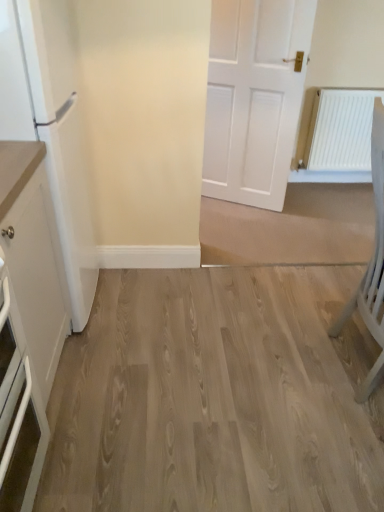
Question: Is white glossy refrigerator at left facing towards light wood flooring at center?

Choices:
 (A) yes
 (B) no

Answer: (A)

Question: From the image's perspective, is white glossy refrigerator at left below light wood flooring at center?

Choices:
 (A) no
 (B) yes

Answer: (A)

Question: Is white glossy refrigerator at left facing away from light wood flooring at center?

Choices:
 (A) no
 (B) yes

Answer: (A)

Question: Is white glossy refrigerator at left directly adjacent to light wood flooring at center?

Choices:
 (A) no
 (B) yes

Answer: (A)

Question: Is white glossy refrigerator at left shorter than light wood flooring at center?

Choices:
 (A) no
 (B) yes

Answer: (A)

Question: From a real-world perspective, is white glossy refrigerator at left physically located above or below light wood flooring at center?

Choices:
 (A) below
 (B) above

Answer: (B)

Question: Based on their sizes in the image, would you say white glossy refrigerator at left is bigger or smaller than light wood flooring at center?

Choices:
 (A) small
 (B) big

Answer: (A)

Question: Looking at their shapes, would you say white glossy refrigerator at left is wider or thinner than light wood flooring at center?

Choices:
 (A) wide
 (B) thin

Answer: (B)

Question: From the image's perspective, is white glossy refrigerator at left above or below light wood flooring at center?

Choices:
 (A) below
 (B) above

Answer: (B)

Question: From a real-world perspective, is light wood flooring at center positioned above or below white glossy refrigerator at left?

Choices:
 (A) below
 (B) above

Answer: (A)

Question: From their relative heights in the image, would you say light wood flooring at center is taller or shorter than white glossy refrigerator at left?

Choices:
 (A) tall
 (B) short

Answer: (B)

Question: In terms of width, does light wood flooring at center look wider or thinner when compared to white glossy refrigerator at left?

Choices:
 (A) thin
 (B) wide

Answer: (B)

Question: Choose the correct answer: Is light wood flooring at center inside white glossy refrigerator at left or outside it?

Choices:
 (A) inside
 (B) outside

Answer: (B)

Question: In terms of size, does light wood flooring at center appear bigger or smaller than light gray wooden chair at right?

Choices:
 (A) small
 (B) big

Answer: (B)

Question: In the image, is light wood flooring at center on the left side or the right side of light gray wooden chair at right?

Choices:
 (A) right
 (B) left

Answer: (B)